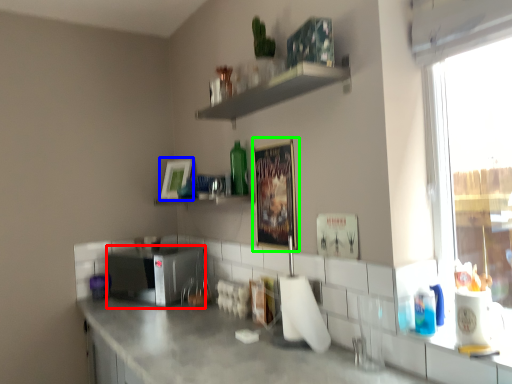
Question: Which object is the farthest from appliance (highlighted by a red box)? Choose among these: picture frame (highlighted by a blue box) or picture frame (highlighted by a green box).

Choices:
 (A) picture frame
 (B) picture frame

Answer: (B)